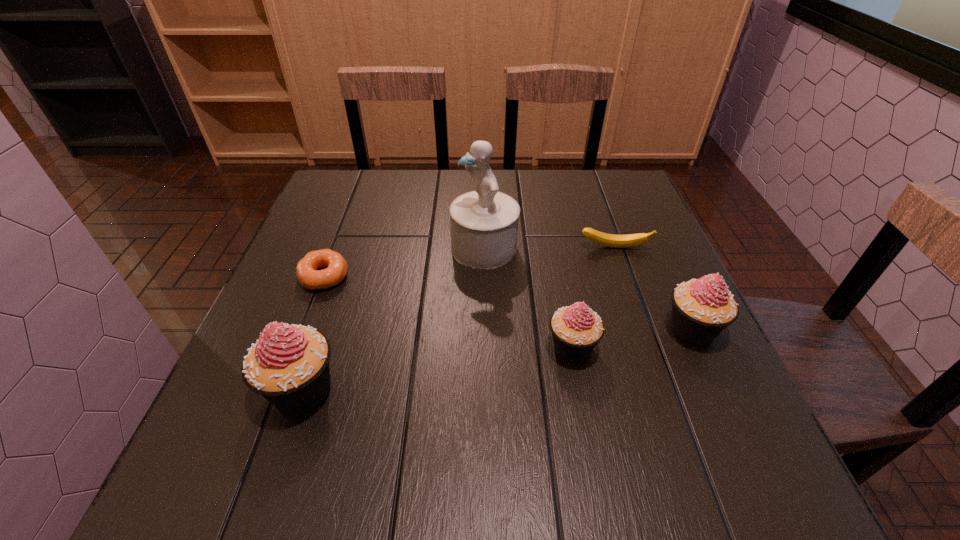
Select which cupcake is the second closest to the fourth object from left to right. Please provide its 2D coordinates. Your answer should be formatted as a tuple, i.e. [(x, y)], where the tuple contains the x and y coordinates of a point satisfying the conditions above.

[(289, 365)]

The width and height of the screenshot is (960, 540). Identify the location of cupcake that can be found as the closest to the second tallest cupcake. (576, 329).

Where is `free location that satisfies the following two spatial constraints: 1. at the beak of the figurine; 2. on the left side of the rightmost cupcake`? The width and height of the screenshot is (960, 540). free location that satisfies the following two spatial constraints: 1. at the beak of the figurine; 2. on the left side of the rightmost cupcake is located at coordinates (486, 329).

Locate an element on the screen. The height and width of the screenshot is (540, 960). free spot that satisfies the following two spatial constraints: 1. at the stem of the second shortest object; 2. at the beak of the tallest object is located at coordinates (614, 248).

At what (x,y) coordinates should I click in order to perform the action: click on free space that satisfies the following two spatial constraints: 1. on the front side of the second tallest cupcake; 2. on the right side of the doughnut. Please return your answer as a coordinate pair (x, y). The image size is (960, 540). Looking at the image, I should click on (304, 329).

The image size is (960, 540). Find the location of `free space that satisfies the following two spatial constraints: 1. on the back side of the shortest cupcake; 2. on the right side of the leftmost cupcake`. free space that satisfies the following two spatial constraints: 1. on the back side of the shortest cupcake; 2. on the right side of the leftmost cupcake is located at coordinates (316, 348).

This screenshot has width=960, height=540. In order to click on free space that satisfies the following two spatial constraints: 1. on the front side of the leftmost cupcake; 2. on the right side of the shortest object in this screenshot , I will do `click(281, 390)`.

I want to click on vacant space that satisfies the following two spatial constraints: 1. at the beak of the fourth tallest object; 2. on the left side of the figurine, so click(x=486, y=348).

This screenshot has width=960, height=540. What are the coordinates of `free location that satisfies the following two spatial constraints: 1. at the beak of the third object from left to right; 2. on the right side of the shortest cupcake` in the screenshot? It's located at (486, 348).